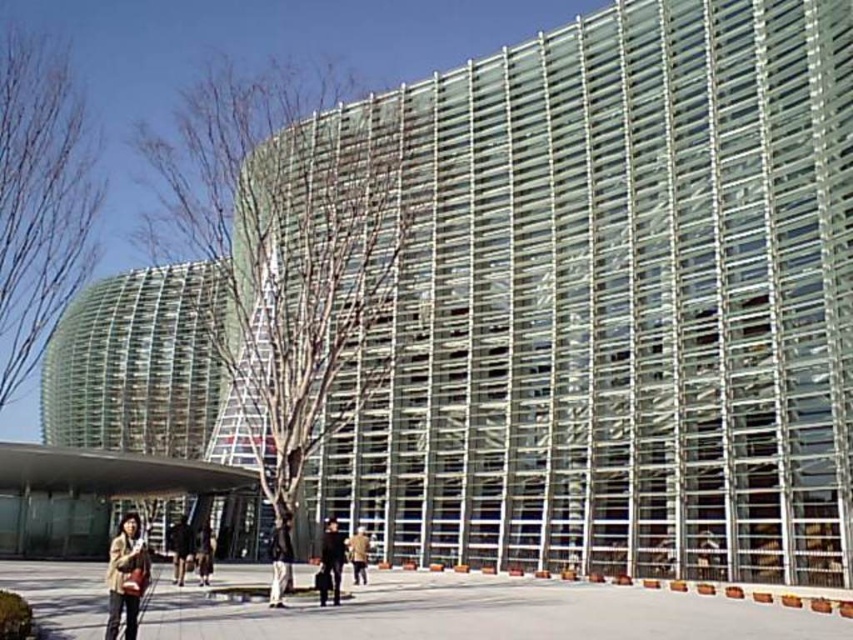
Question: Can you confirm if matte brown jacket at lower left is positioned below dark blue fabric jacket at center?

Choices:
 (A) yes
 (B) no

Answer: (A)

Question: Estimate the real-world distances between objects in this image. Which object is farther from the dark blue fabric jacket at center?

Choices:
 (A) brown leather jacket at lower center
 (B) green leafless tree at center
 (C) dark gray fabric pants at center

Answer: (B)

Question: Which of the following is the farthest from the observer?

Choices:
 (A) (328, 524)
 (B) (3, 378)
 (C) (277, 580)
 (D) (286, 168)

Answer: (D)

Question: Does bare branches at left have a greater width compared to dark gray fabric pants at center?

Choices:
 (A) yes
 (B) no

Answer: (A)

Question: Estimate the real-world distances between objects in this image. Which object is farther from the tan leather jacket at center?

Choices:
 (A) dark blue fabric jacket at center
 (B) dark gray fabric pants at center

Answer: (B)

Question: Is the position of green leafless tree at center more distant than that of brown leather jacket at lower center?

Choices:
 (A) no
 (B) yes

Answer: (A)